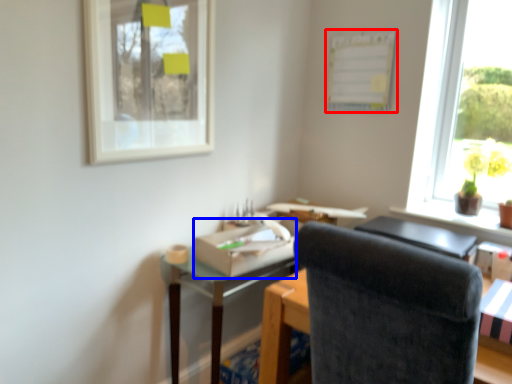
Question: Which point is further to the camera, bulletin board (highlighted by a red box) or cardboard box (highlighted by a blue box)?

Choices:
 (A) bulletin board
 (B) cardboard box

Answer: (A)